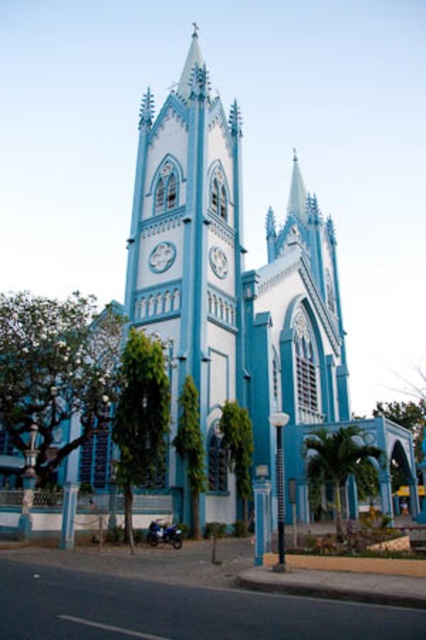
Which is in front, point (154, 257) or point (221, 260)?

Point (154, 257) is in front.

Between metallic silver clock at center and white glossy clock at center, which one has more height?

Standing taller between the two is white glossy clock at center.

The height and width of the screenshot is (640, 426). Identify the location of metallic silver clock at center. (161, 257).

Image resolution: width=426 pixels, height=640 pixels. In order to click on metallic silver clock at center in this screenshot , I will do `click(161, 257)`.

Who is higher up, blue painted stone tower at center or metallic silver clock at center?

Positioned higher is blue painted stone tower at center.

The width and height of the screenshot is (426, 640). What do you see at coordinates (192, 253) in the screenshot?
I see `blue painted stone tower at center` at bounding box center [192, 253].

You are a GUI agent. You are given a task and a screenshot of the screen. Output one action in this format:
    pyautogui.click(x=<x>, y=<y>)
    Task: Click on the blue painted stone tower at center
    The image size is (426, 640).
    Given the screenshot: What is the action you would take?
    (x=192, y=253)

Is blue painted stone tower at center wider than white glossy clock at center?

Yes.

Between point (198, 358) and point (215, 246), which one is positioned in front?

Positioned in front is point (198, 358).

You are a GUI agent. You are given a task and a screenshot of the screen. Output one action in this format:
    pyautogui.click(x=<x>, y=<y>)
    Task: Click on the blue painted stone tower at center
    The height and width of the screenshot is (640, 426).
    Given the screenshot: What is the action you would take?
    pyautogui.click(x=192, y=253)